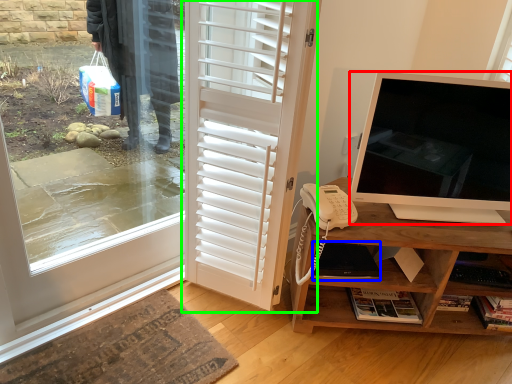
Question: Which object is positioned closest to television (highlighted by a red box)? Select from laptop (highlighted by a blue box) and door (highlighted by a green box).

Choices:
 (A) laptop
 (B) door

Answer: (A)